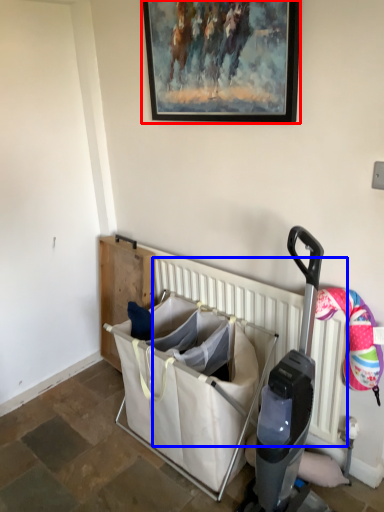
Question: Which object is closer to the camera taking this photo, picture frame (highlighted by a red box) or radiator (highlighted by a blue box)?

Choices:
 (A) picture frame
 (B) radiator

Answer: (A)